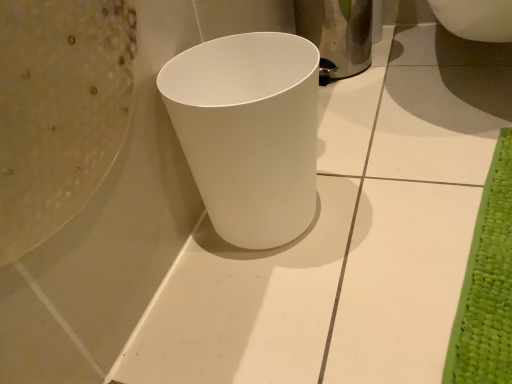
Image resolution: width=512 pixels, height=384 pixels. I want to click on free space in front of white matte trash can at center, so click(293, 312).